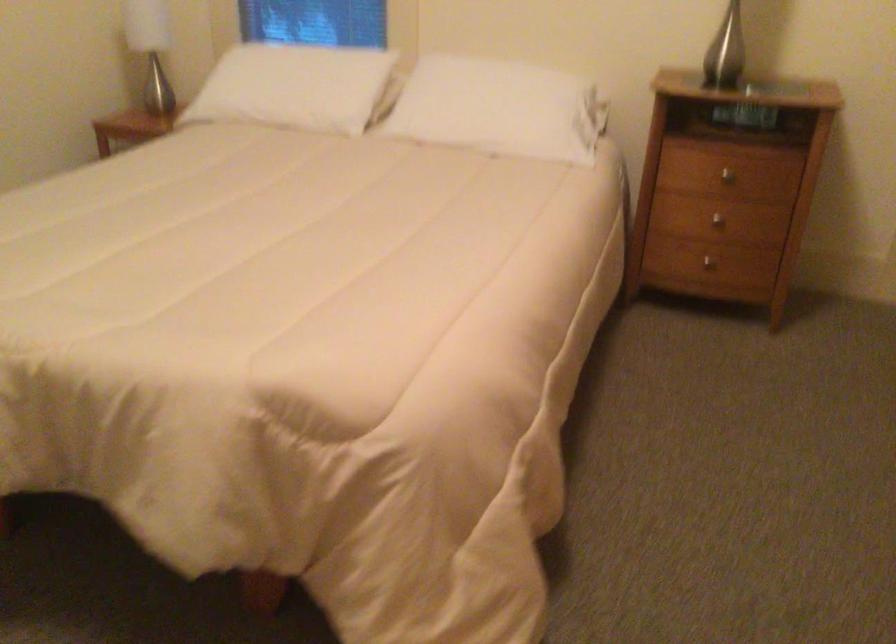
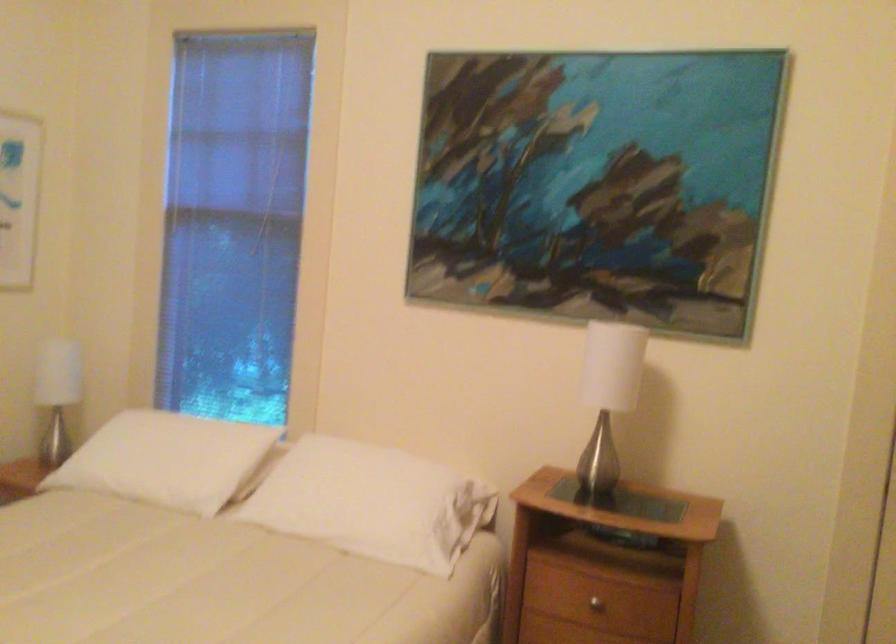
Find the pixel in the second image that matches point (722, 169) in the first image.

(597, 601)